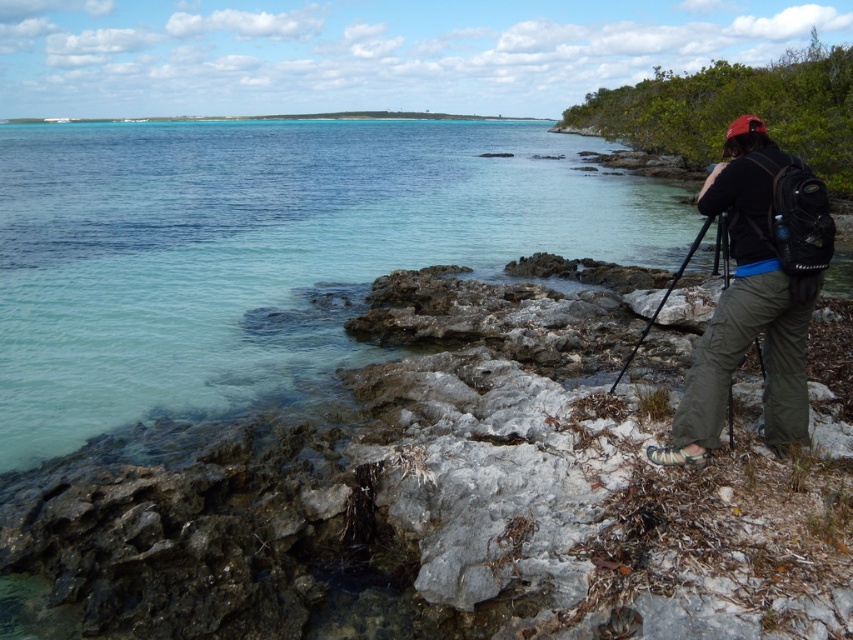
Is point (161, 275) positioned after point (767, 284)?

That is True.

Does clear water at center have a greater height compared to dark gray pants at right?

Yes, clear water at center is taller than dark gray pants at right.

The height and width of the screenshot is (640, 853). What are the coordinates of `clear water at center` in the screenshot? It's located at [x=262, y=252].

Does clear water at center appear under black matte tripod at right?

Incorrect, clear water at center is not positioned below black matte tripod at right.

Between point (218, 321) and point (682, 266), which one is positioned in front?

Point (682, 266) is in front.

You are a GUI agent. You are given a task and a screenshot of the screen. Output one action in this format:
    pyautogui.click(x=<x>, y=<y>)
    Task: Click on the clear water at center
    The image size is (853, 640).
    Given the screenshot: What is the action you would take?
    pyautogui.click(x=262, y=252)

Image resolution: width=853 pixels, height=640 pixels. Describe the element at coordinates (756, 292) in the screenshot. I see `dark gray pants at right` at that location.

Which is more to the left, dark gray pants at right or black matte tripod at right?

dark gray pants at right

Where is `dark gray pants at right`? The image size is (853, 640). dark gray pants at right is located at coordinates (x=756, y=292).